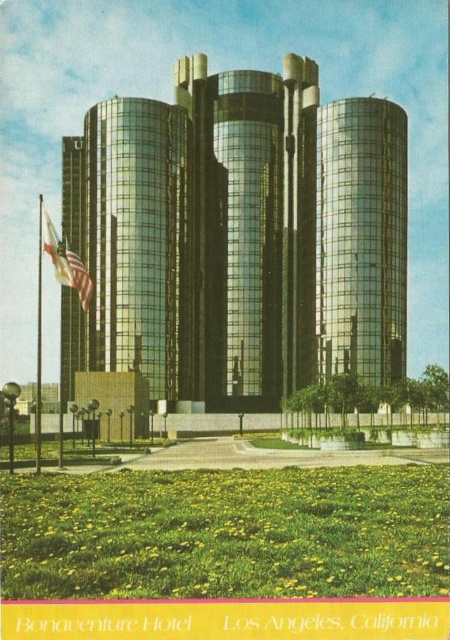
Question: Which of the following is the closest to the observer?

Choices:
 (A) american flag at left
 (B) metallic flag pole at left
 (C) shiny glass building at center

Answer: (A)

Question: Does american flag at left lie in front of metallic flag pole at left?

Choices:
 (A) no
 (B) yes

Answer: (B)

Question: Among these points, which one is nearest to the camera?

Choices:
 (A) (228, 269)
 (B) (325, 212)

Answer: (B)

Question: Is shiny glass building at center further to the viewer compared to metallic flag pole at left?

Choices:
 (A) no
 (B) yes

Answer: (B)

Question: Does shiny glass building at center lie behind metallic flag pole at left?

Choices:
 (A) yes
 (B) no

Answer: (A)

Question: Which object is positioned closest to the shiny glass building at center?

Choices:
 (A) american flag at left
 (B) metallic flag pole at left

Answer: (A)